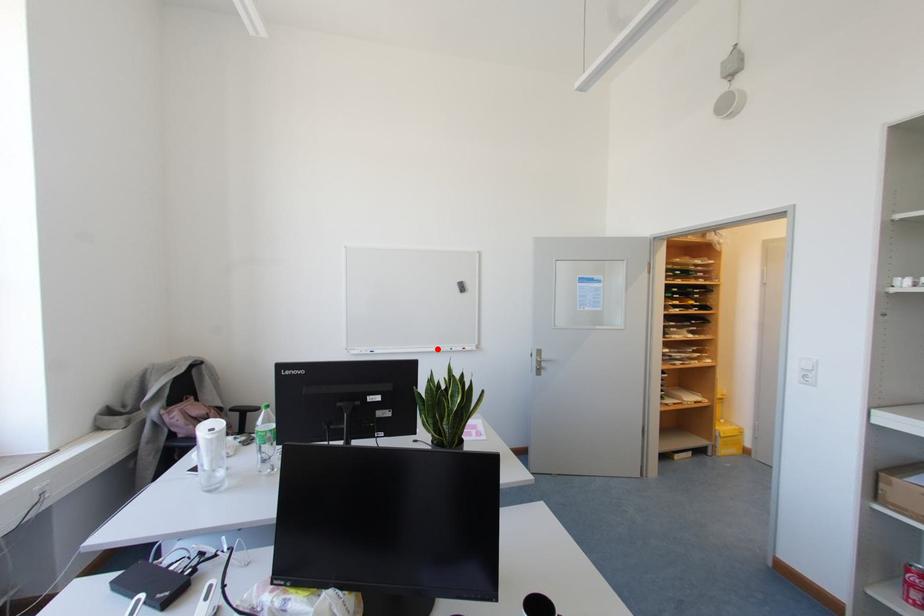
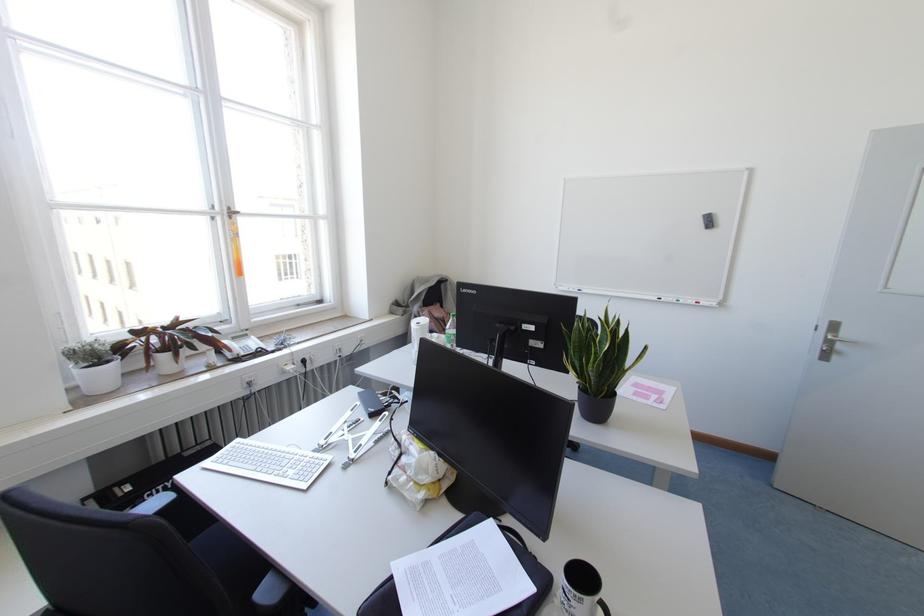
Locate, in the second image, the point that corresponds to the highlighted location in the first image.

(659, 299)